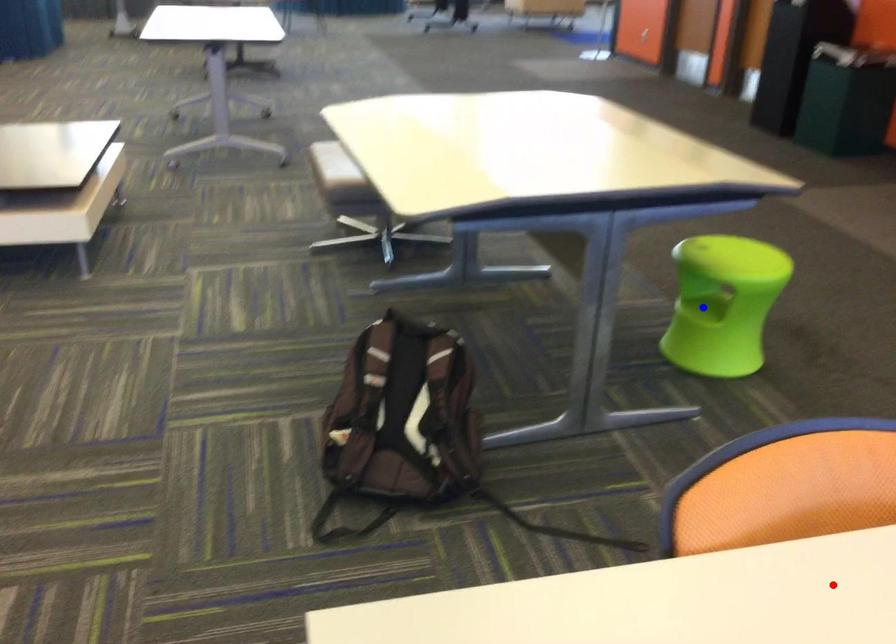
Question: Which of the two points in the image is closer to the camera?

Choices:
 (A) Blue point is closer.
 (B) Red point is closer.

Answer: (B)